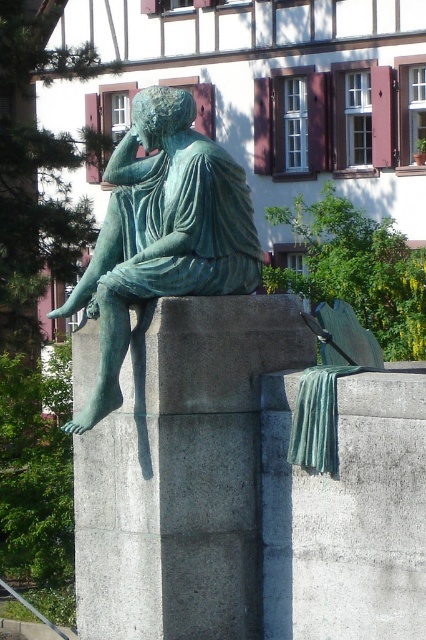
Question: Which object is farther from the camera taking this photo?

Choices:
 (A) green patina bronze statue at center
 (B) green stone pillar at center

Answer: (B)

Question: Can you confirm if green stone pillar at center is wider than green patina bronze statue at center?

Choices:
 (A) no
 (B) yes

Answer: (B)

Question: Which point is farther from the camera taking this photo?

Choices:
 (A) (97, 396)
 (B) (256, 528)

Answer: (B)

Question: Does green stone pillar at center appear on the left side of green patina bronze statue at center?

Choices:
 (A) yes
 (B) no

Answer: (B)

Question: Does green stone pillar at center come in front of green patina bronze statue at center?

Choices:
 (A) no
 (B) yes

Answer: (A)